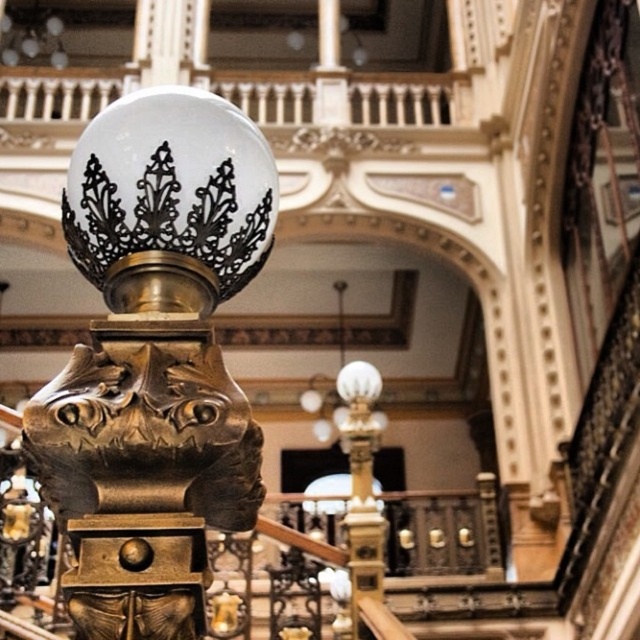
You are standing in the grand hall and want to place a new decorative item between the matte gold sculpture at center and the gold polished metal lamp post at center. Based on their positions, which object should the new item be closer to?

The matte gold sculpture at center is to the left of the gold polished metal lamp post at center, so the new item should be placed closer to the gold polished metal lamp post at center to maintain symmetry between the two objects.

From the picture: You are standing in the ornate interior space and want to determine which of the two points, point (259, 493) or point (371, 484), is nearer to you. Based on the scene description, which point is closer?

Point (259, 493) is closer to the viewer than point (371, 484).